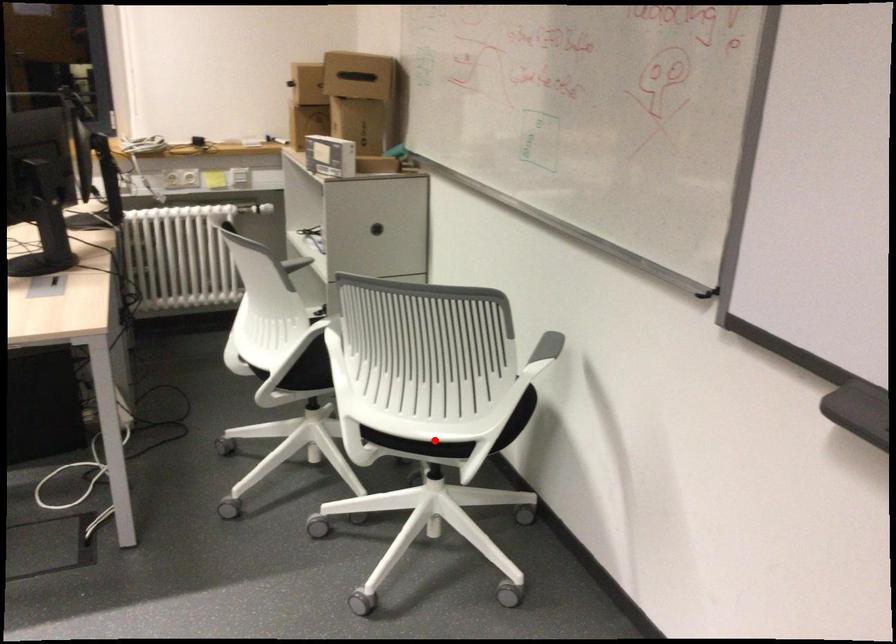
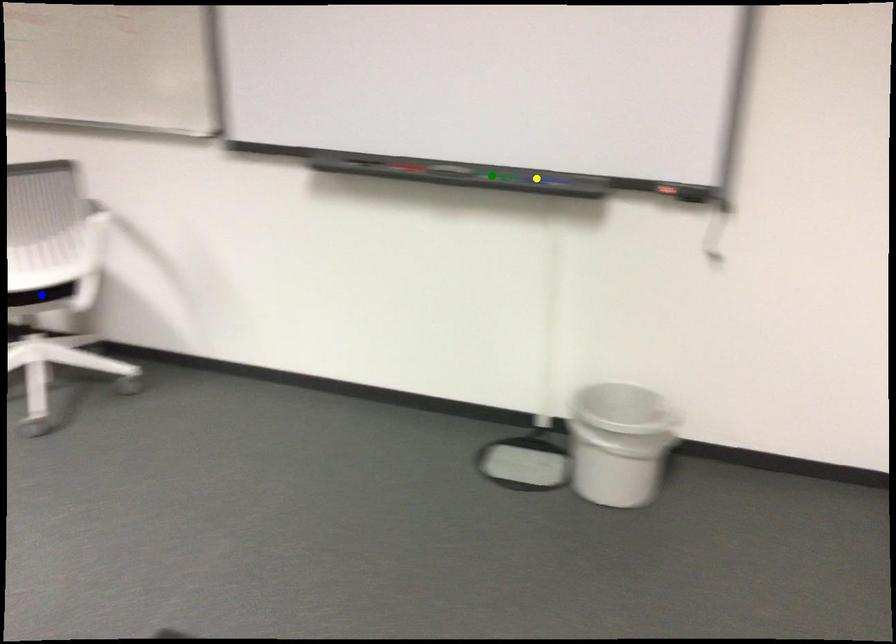
Question: I am providing you with two images of the same scene from different viewpoints. A red point is marked on the first image. You are given multiple points on the second image. In image 2, which mark is for the same physical point as the one in image 1?

Choices:
 (A) yellow point
 (B) blue point
 (C) green point

Answer: (B)